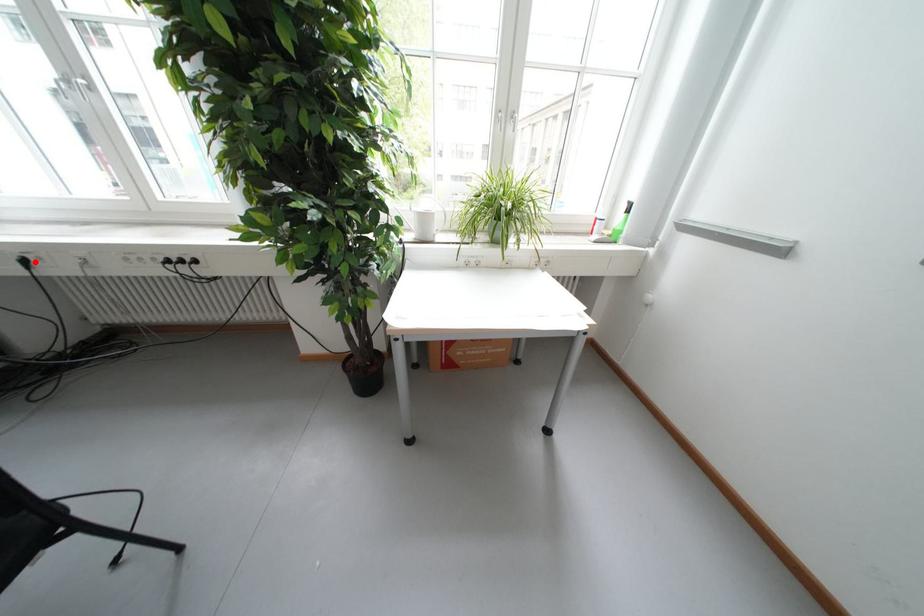
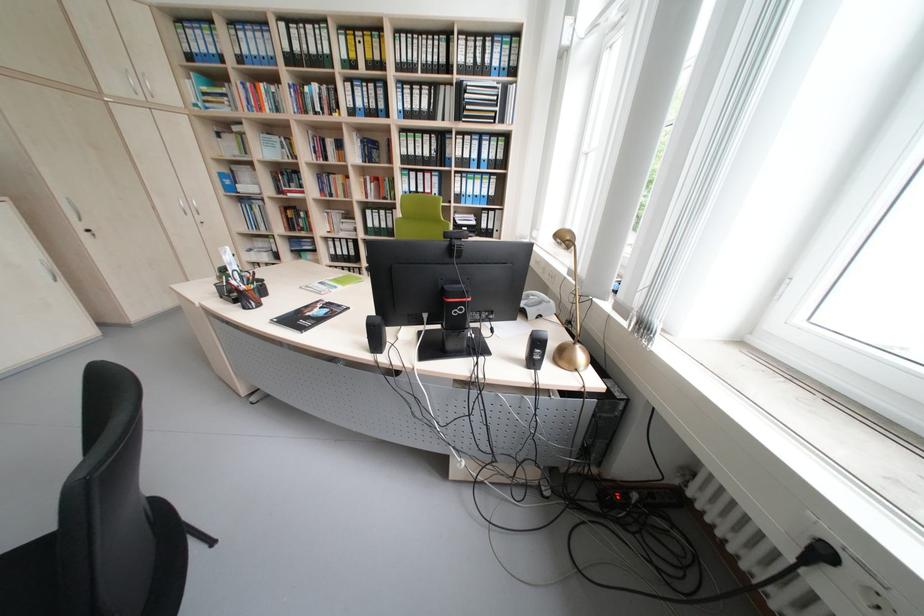
Locate, in the second image, the point that corresponds to the highlighted location in the first image.

(833, 554)